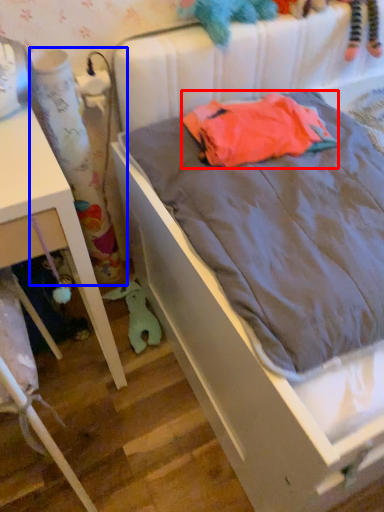
Question: Which point is closer to the camera, baby clothe (highlighted by a red box) or curtain (highlighted by a blue box)?

Choices:
 (A) baby clothe
 (B) curtain

Answer: (B)